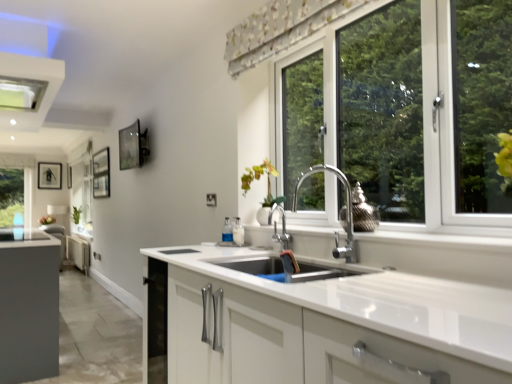
Question: Is white glossy vase at center smaller than floral fabric curtain at upper center?

Choices:
 (A) no
 (B) yes

Answer: (B)

Question: Is white glossy vase at center behind floral fabric curtain at upper center?

Choices:
 (A) no
 (B) yes

Answer: (B)

Question: Can we say white glossy vase at center lies outside floral fabric curtain at upper center?

Choices:
 (A) no
 (B) yes

Answer: (B)

Question: Does white glossy vase at center come in front of floral fabric curtain at upper center?

Choices:
 (A) yes
 (B) no

Answer: (B)

Question: From the image's perspective, is white glossy vase at center over floral fabric curtain at upper center?

Choices:
 (A) yes
 (B) no

Answer: (B)

Question: Can you confirm if white glossy vase at center is positioned to the left of floral fabric curtain at upper center?

Choices:
 (A) no
 (B) yes

Answer: (B)

Question: Is the position of floral fabric curtain at upper center less distant than that of matte black picture frame at left, the second picture frame when ordered from front to back?

Choices:
 (A) no
 (B) yes

Answer: (B)

Question: Considering the relative positions of floral fabric curtain at upper center and matte black picture frame at left, the first picture frame viewed from the back, in the image provided, is floral fabric curtain at upper center to the left of matte black picture frame at left, the first picture frame viewed from the back, from the viewer's perspective?

Choices:
 (A) no
 (B) yes

Answer: (A)

Question: From a real-world perspective, is floral fabric curtain at upper center beneath matte black picture frame at left, which is counted as the 2th picture frame, starting from the right?

Choices:
 (A) no
 (B) yes

Answer: (A)

Question: Is floral fabric curtain at upper center positioned behind matte black picture frame at left, which is the first picture frame from left to right?

Choices:
 (A) no
 (B) yes

Answer: (A)

Question: Can you confirm if floral fabric curtain at upper center is bigger than matte black picture frame at left, which is counted as the 2th picture frame, starting from the right?

Choices:
 (A) yes
 (B) no

Answer: (A)

Question: Is floral fabric curtain at upper center in contact with matte black picture frame at left, the second picture frame when ordered from front to back?

Choices:
 (A) yes
 (B) no

Answer: (B)

Question: Can you confirm if green matte plant at left is taller than white glossy vase at center?

Choices:
 (A) no
 (B) yes

Answer: (B)